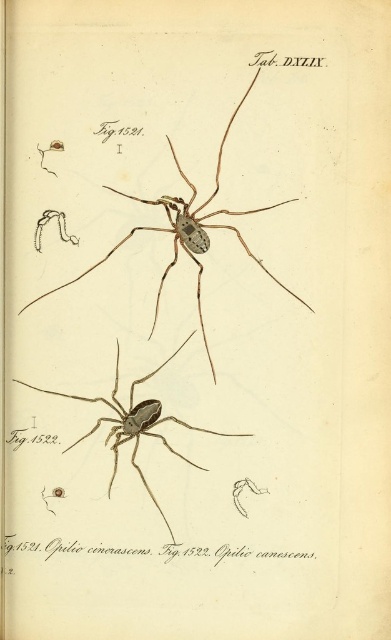
Question: Which point is farther to the camera?

Choices:
 (A) translucent brown spider at upper center
 (B) matte black spider at center

Answer: (B)

Question: Can you confirm if translucent brown spider at upper center is positioned above matte black spider at center?

Choices:
 (A) no
 (B) yes

Answer: (B)

Question: Among these objects, which one is nearest to the camera?

Choices:
 (A) translucent brown spider at upper center
 (B) matte black spider at center

Answer: (A)

Question: Is translucent brown spider at upper center behind matte black spider at center?

Choices:
 (A) yes
 (B) no

Answer: (B)

Question: In this image, where is translucent brown spider at upper center located relative to matte black spider at center?

Choices:
 (A) below
 (B) above

Answer: (B)